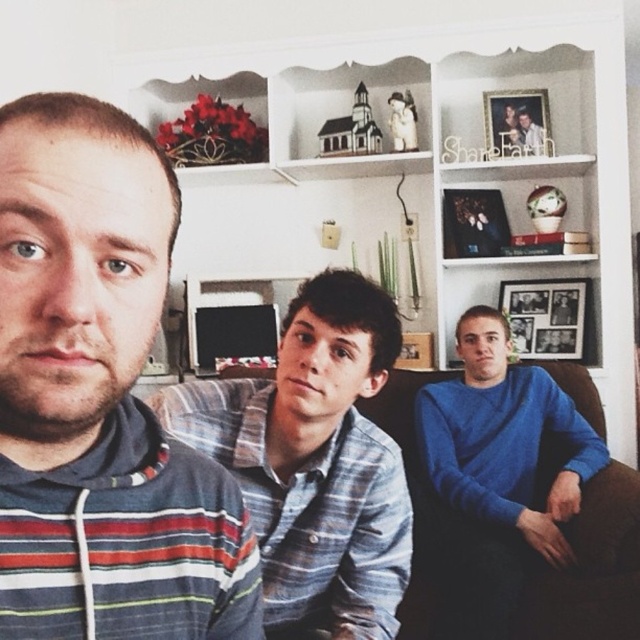
You are a photographer trying to capture a clear shot of the wooden photo frame at center and the blue striped shirt at center. Which object should you focus on first if you want to ensure both are in focus without changing the camera settings?

The wooden photo frame at center is located below the blue striped shirt at center, so you should focus on the blue striped shirt at center first. This ensures that the depth of field will cover both objects since they are vertically aligned.

You are organizing a gallery wall and have two wooden photo frames to place. The wooden photo frame at center and the wooden photo frame at upper right. Which one should you choose if you want the larger frame to be placed above the smaller one?

The wooden photo frame at center is larger in size than the wooden photo frame at upper right. Therefore, to place the larger frame above the smaller one, you should position the wooden photo frame at center above the wooden photo frame at upper right.